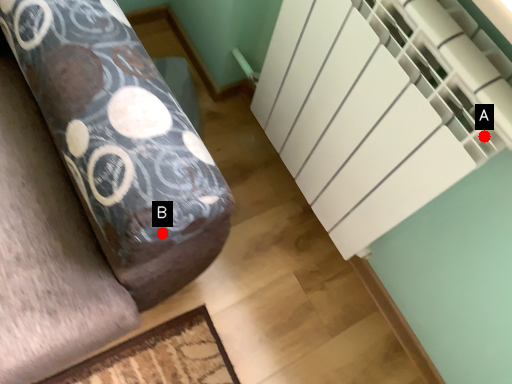
Question: Two points are circled on the image, labeled by A and B beside each circle. Which of the following is the farthest from the observer?

Choices:
 (A) A is further
 (B) B is further

Answer: (B)